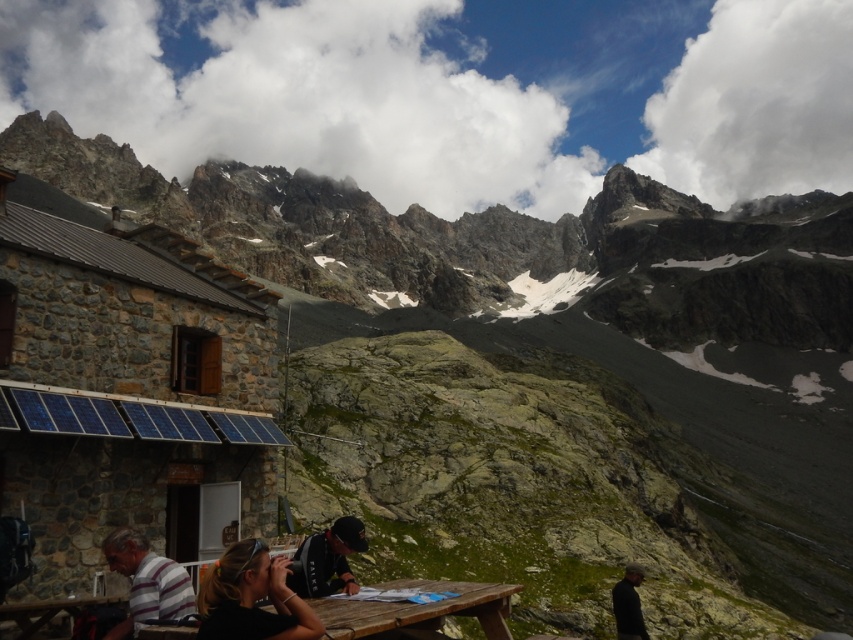
Can you confirm if black hair at lower center is positioned above black fabric at lower right?

Correct, black hair at lower center is located above black fabric at lower right.

Between point (297, 596) and point (621, 634), which one is positioned behind?

Positioned behind is point (621, 634).

At what (x,y) coordinates should I click in order to perform the action: click on black hair at lower center. Please return your answer as a coordinate pair (x, y). Image resolution: width=853 pixels, height=640 pixels. Looking at the image, I should click on (251, 596).

Is striped cotton shirt at lower left taller than black fabric at center?

Indeed, striped cotton shirt at lower left has a greater height compared to black fabric at center.

This screenshot has width=853, height=640. Find the location of `striped cotton shirt at lower left`. striped cotton shirt at lower left is located at coordinates (146, 580).

Is point (167, 605) less distant than point (310, 550)?

Yes, point (167, 605) is in front of point (310, 550).

Identify the location of striped cotton shirt at lower left. (146, 580).

Is the position of black fabric shirt at lower left less distant than that of striped cotton shirt at lower left?

Yes, black fabric shirt at lower left is in front of striped cotton shirt at lower left.

Can you confirm if black fabric shirt at lower left is positioned to the right of striped cotton shirt at lower left?

Yes, black fabric shirt at lower left is to the right of striped cotton shirt at lower left.

You are a GUI agent. You are given a task and a screenshot of the screen. Output one action in this format:
    pyautogui.click(x=<x>, y=<y>)
    Task: Click on the black fabric shirt at lower left
    The height and width of the screenshot is (640, 853).
    Given the screenshot: What is the action you would take?
    pyautogui.click(x=256, y=588)